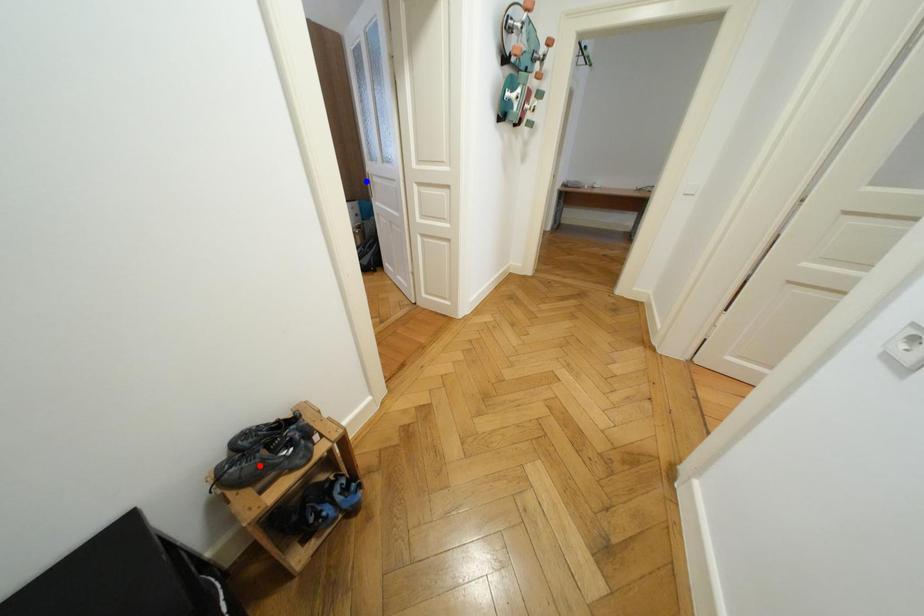
Question: Which of the two points in the image is closer to the camera?

Choices:
 (A) Blue point is closer.
 (B) Red point is closer.

Answer: (B)